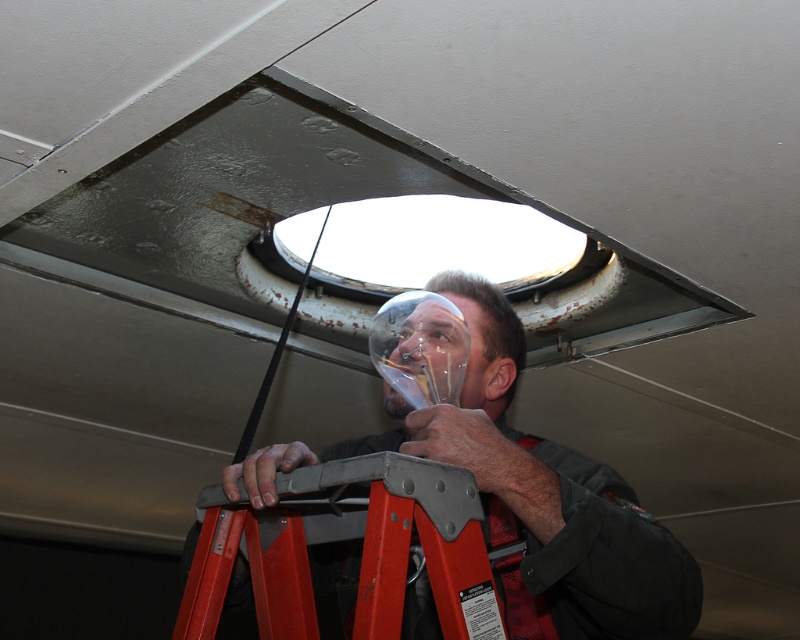
Does point (648, 627) come behind point (462, 520)?

That is True.

Between point (666, 589) and point (377, 531), which one is positioned behind?

The point (666, 589) is behind.

Looking at this image, who is more forward, (468, 275) or (388, 522)?

Point (388, 522) is more forward.

I want to click on clear plastic lightbulb at center, so click(528, 496).